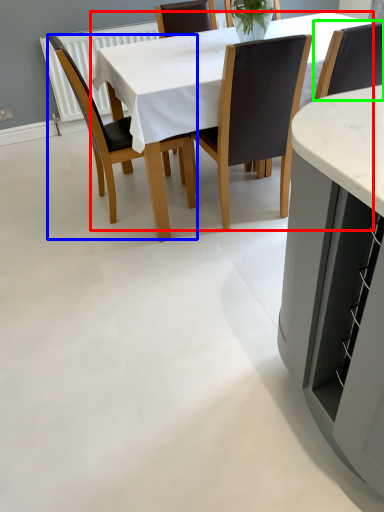
Question: Estimate the real-world distances between objects in this image. Which object is farther from kitchen & dining room table (highlighted by a red box), chair (highlighted by a blue box) or chair (highlighted by a green box)?

Choices:
 (A) chair
 (B) chair

Answer: (B)